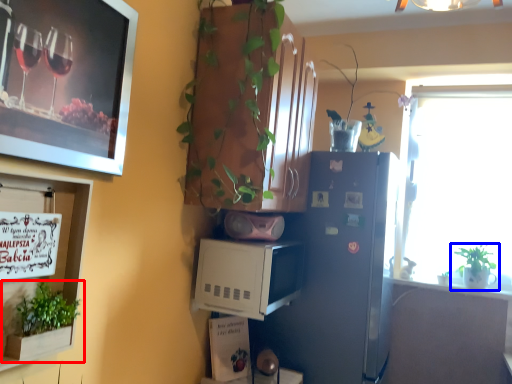
Question: Which of the following is the closest to the observer, houseplant (highlighted by a red box) or houseplant (highlighted by a blue box)?

Choices:
 (A) houseplant
 (B) houseplant

Answer: (A)